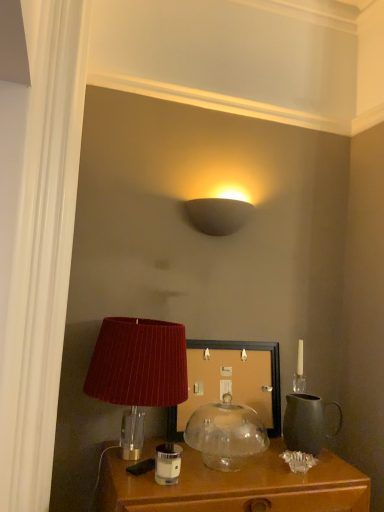
Question: Is matte wooden picture frame at center thinner than transparent glass dome at center, the 3th lamp when ordered from top to bottom?

Choices:
 (A) no
 (B) yes

Answer: (B)

Question: Is matte wooden picture frame at center surrounding transparent glass dome at center, marked as the first lamp in a bottom-to-top arrangement?

Choices:
 (A) yes
 (B) no

Answer: (B)

Question: Considering the relative positions of matte wooden picture frame at center and transparent glass dome at center, marked as the first lamp in a bottom-to-top arrangement, in the image provided, is matte wooden picture frame at center to the left of transparent glass dome at center, marked as the first lamp in a bottom-to-top arrangement, from the viewer's perspective?

Choices:
 (A) no
 (B) yes

Answer: (B)

Question: From the image's perspective, is matte wooden picture frame at center above transparent glass dome at center, the 3th lamp when ordered from top to bottom?

Choices:
 (A) yes
 (B) no

Answer: (A)

Question: Is the surface of matte wooden picture frame at center in direct contact with transparent glass dome at center, the 3th lamp when ordered from top to bottom?

Choices:
 (A) yes
 (B) no

Answer: (B)

Question: Is velvet red lampshade at lower left, arranged as the 2th lamp when viewed from the top, wider or thinner than clear glass candle holder at lower center?

Choices:
 (A) thin
 (B) wide

Answer: (B)

Question: Is point (127, 401) positioned closer to the camera than point (172, 461)?

Choices:
 (A) closer
 (B) farther

Answer: (B)

Question: Is velvet red lampshade at lower left, which is the 2th lamp from bottom to top, in front of or behind clear glass candle holder at lower center in the image?

Choices:
 (A) front
 (B) behind

Answer: (A)

Question: Based on their sizes in the image, would you say velvet red lampshade at lower left, arranged as the 2th lamp when viewed from the top, is bigger or smaller than clear glass candle holder at lower center?

Choices:
 (A) big
 (B) small

Answer: (A)

Question: From the image's perspective, is matte wooden picture frame at center above or below clear glass candle holder at lower center?

Choices:
 (A) above
 (B) below

Answer: (A)

Question: From a real-world perspective, relative to clear glass candle holder at lower center, is matte wooden picture frame at center vertically above or below?

Choices:
 (A) below
 (B) above

Answer: (B)

Question: Relative to clear glass candle holder at lower center, is matte wooden picture frame at center in front or behind?

Choices:
 (A) behind
 (B) front

Answer: (A)

Question: Considering the relative positions of matte wooden picture frame at center and clear glass candle holder at lower center in the image provided, is matte wooden picture frame at center to the left or to the right of clear glass candle holder at lower center?

Choices:
 (A) right
 (B) left

Answer: (A)

Question: From the image's perspective, relative to velvet red lampshade at lower left, arranged as the 2th lamp when viewed from the top, is matte wooden picture frame at center above or below?

Choices:
 (A) above
 (B) below

Answer: (B)

Question: Is point (266, 356) closer or farther from the camera than point (127, 437)?

Choices:
 (A) closer
 (B) farther

Answer: (B)